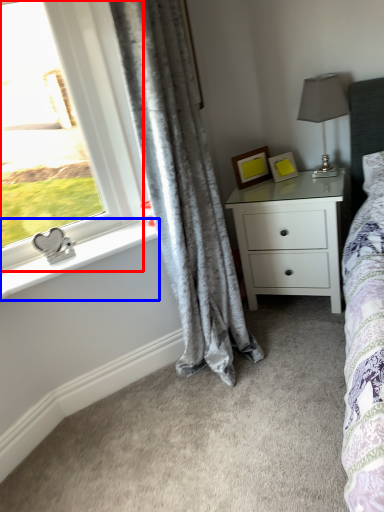
Question: Which of the following is the closest to the observer, window (highlighted by a red box) or window sill (highlighted by a blue box)?

Choices:
 (A) window
 (B) window sill

Answer: (A)